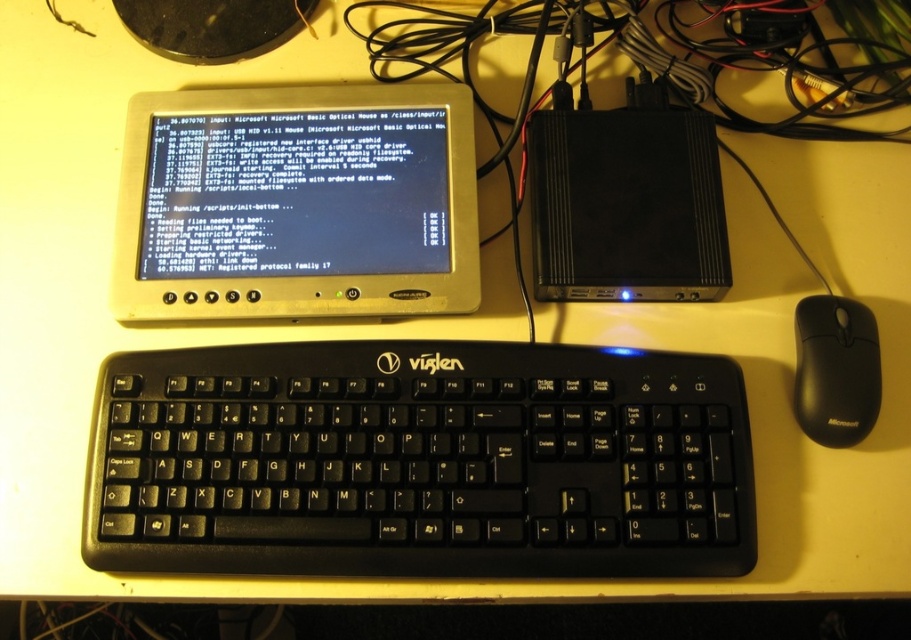
Does black plastic keyboard at center have a greater height compared to black plastic mouse at lower right?

Indeed, black plastic keyboard at center has a greater height compared to black plastic mouse at lower right.

Is point (527, 573) positioned behind point (845, 413)?

No, it is not.

The image size is (911, 640). In order to click on black plastic keyboard at center in this screenshot , I will do tap(420, 461).

Is point (263, 397) in front of point (370, 273)?

Yes.

Between black plastic keyboard at center and metallic silver monitor at center, which one is positioned higher?

Positioned higher is metallic silver monitor at center.

What do you see at coordinates (420, 461) in the screenshot? I see `black plastic keyboard at center` at bounding box center [420, 461].

Where is `black plastic keyboard at center`? The image size is (911, 640). black plastic keyboard at center is located at coordinates (420, 461).

Can you confirm if metallic silver monitor at center is positioned below black plastic mouse at lower right?

Actually, metallic silver monitor at center is above black plastic mouse at lower right.

Is metallic silver monitor at center above black plastic mouse at lower right?

Correct, metallic silver monitor at center is located above black plastic mouse at lower right.

I want to click on metallic silver monitor at center, so click(295, 204).